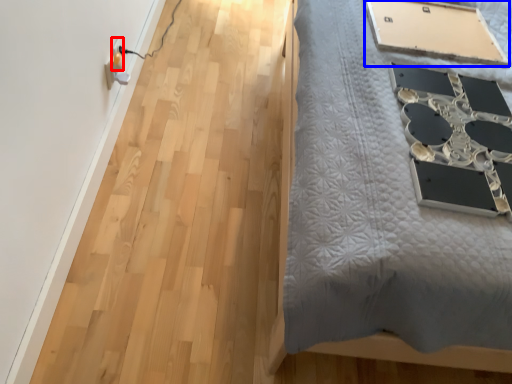
Question: Which point is further to the camera, electric outlet (highlighted by a red box) or table (highlighted by a blue box)?

Choices:
 (A) electric outlet
 (B) table

Answer: (A)